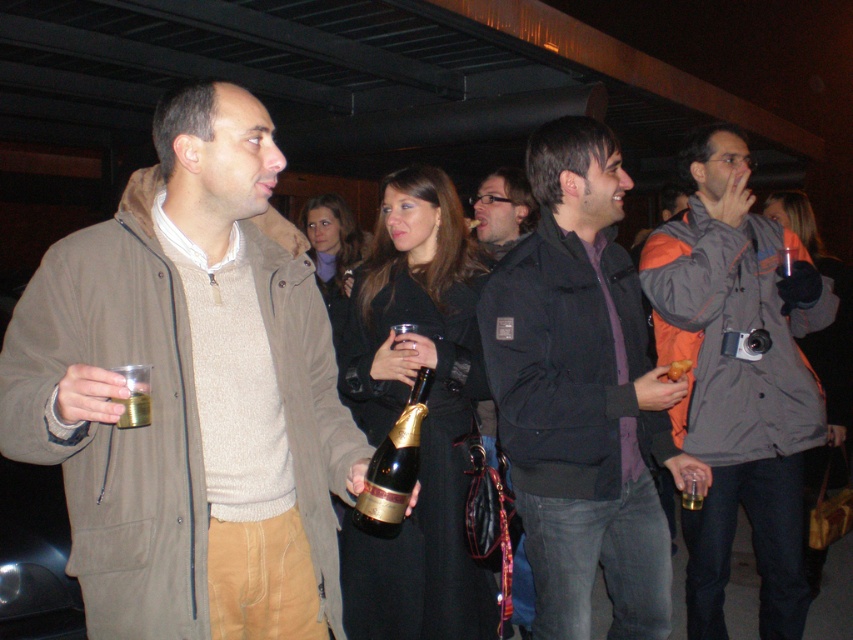
Is matte khaki jacket at left to the right of gray fabric jacket at right from the viewer's perspective?

Incorrect, matte khaki jacket at left is not on the right side of gray fabric jacket at right.

Who is higher up, matte khaki jacket at left or gray fabric jacket at right?

Positioned higher is matte khaki jacket at left.

Is point (83, 403) behind point (701, 204)?

No, it is not.

At what (x,y) coordinates should I click in order to perform the action: click on matte khaki jacket at left. Please return your answer as a coordinate pair (x, y). Looking at the image, I should click on (189, 394).

Is black matte jacket at center to the left of translucent glass bottle at center from the viewer's perspective?

In fact, black matte jacket at center is to the right of translucent glass bottle at center.

Can you confirm if black matte jacket at center is positioned above translucent glass bottle at center?

No.

Find the location of a particular element. black matte jacket at center is located at coordinates click(582, 394).

Is point (560, 289) more distant than point (776, 365)?

No.

Can you confirm if black matte jacket at center is positioned below gray fabric jacket at right?

No, black matte jacket at center is not below gray fabric jacket at right.

Locate an element on the screen. black matte jacket at center is located at coordinates (582, 394).

You are a GUI agent. You are given a task and a screenshot of the screen. Output one action in this format:
    pyautogui.click(x=<x>, y=<y>)
    Task: Click on the black matte jacket at center
    This screenshot has height=640, width=853.
    Given the screenshot: What is the action you would take?
    pyautogui.click(x=582, y=394)